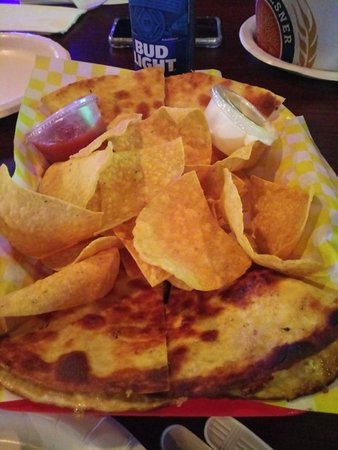
Where is `plates`? Image resolution: width=338 pixels, height=450 pixels. plates is located at coordinates (23, 59).